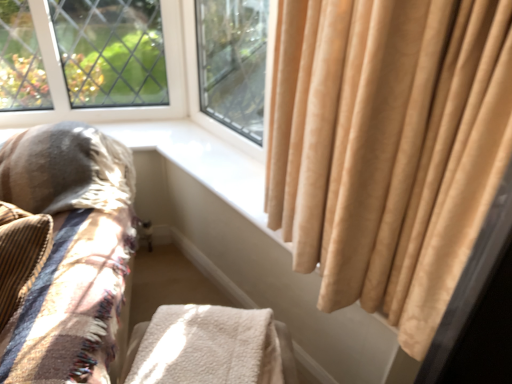
Question: Considering the positions of white fluffy blanket at lower center and plush beige cushion at left in the image, is white fluffy blanket at lower center wider or thinner than plush beige cushion at left?

Choices:
 (A) wide
 (B) thin

Answer: (B)

Question: From a real-world perspective, relative to plush beige cushion at left, is white fluffy blanket at lower center vertically above or below?

Choices:
 (A) below
 (B) above

Answer: (B)

Question: Based on their positions, is white fluffy blanket at lower center located to the left or right of plush beige cushion at left?

Choices:
 (A) left
 (B) right

Answer: (B)

Question: From the image's perspective, is plush beige cushion at left positioned above or below white fluffy blanket at lower center?

Choices:
 (A) below
 (B) above

Answer: (B)

Question: Choose the correct answer: Is plush beige cushion at left inside white fluffy blanket at lower center or outside it?

Choices:
 (A) outside
 (B) inside

Answer: (A)

Question: From a real-world perspective, is plush beige cushion at left above or below white fluffy blanket at lower center?

Choices:
 (A) above
 (B) below

Answer: (B)

Question: Based on their sizes in the image, would you say plush beige cushion at left is bigger or smaller than white fluffy blanket at lower center?

Choices:
 (A) small
 (B) big

Answer: (B)